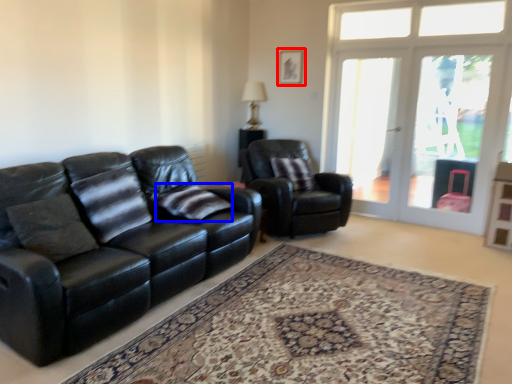
Question: Among these objects, which one is nearest to the camera, picture frame (highlighted by a red box) or pillow (highlighted by a blue box)?

Choices:
 (A) picture frame
 (B) pillow

Answer: (B)